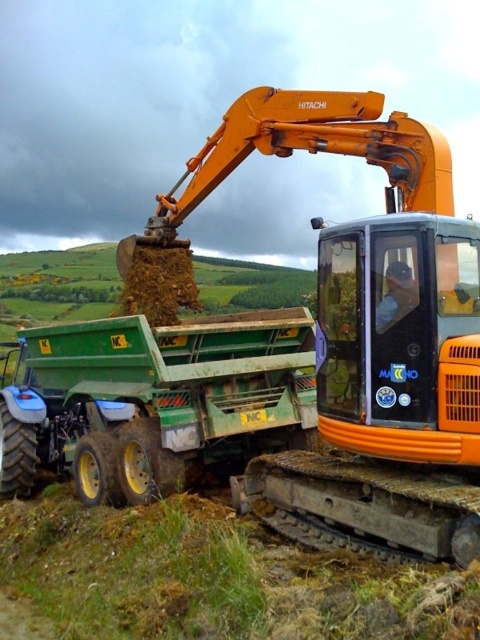
You are a construction worker who needs to move the orange metallic excavator at center to a different location. Since the excavator is currently in front of the green matte trailer truck at center, which direction should you move the excavator to ensure it is no longer blocking the truck?

Since the orange metallic excavator at center is in front of the green matte trailer truck at center, you should move the excavator either to the left or right side to ensure it is no longer blocking the truck.

You are a construction supervisor who needs to ensure that the orange metallic excavator at center and the green matte trailer truck at center are positioned safely. Given their sizes, which one requires more space to maneuver around the construction site?

The orange metallic excavator at center is larger in size than the green matte trailer truck at center, so it requires more space to maneuver around the construction site.

You are standing at a safe distance from the construction site. The point marked at coordinates point (478,502) is part of the construction area. If you want to observe this point without entering the construction zone, can you do so from your current position?

The point marked at coordinates point (478,502) is 12.07 feet away from the viewer. Since this distance is within a safe observation range and the viewer is already at a safe distance, they can observe the point without entering the construction zone.